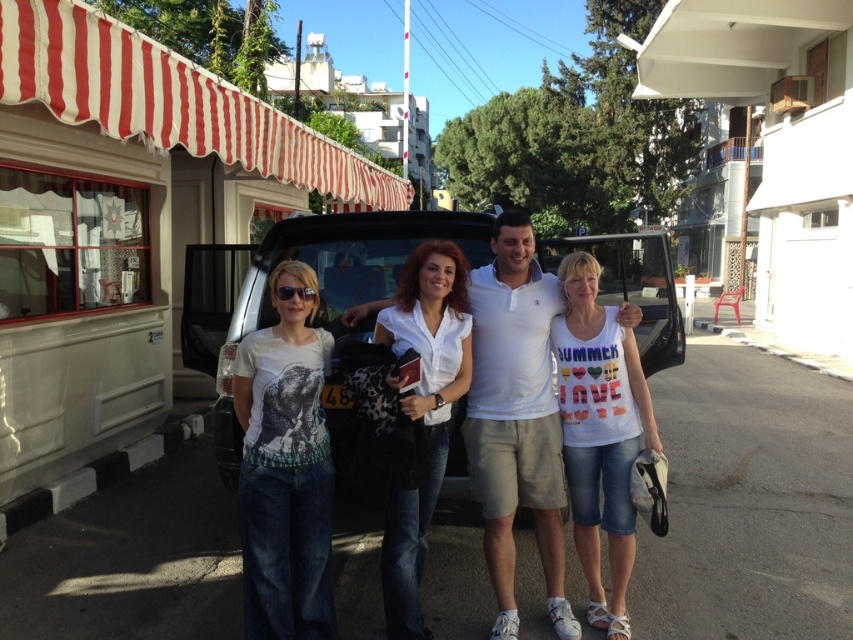
Does point (546, 484) lie behind point (305, 593)?

Yes, point (546, 484) is farther from viewer.

How much distance is there between white cotton polo shirt at center and white printed t-shirt at center?

A distance of 38.63 inches exists between white cotton polo shirt at center and white printed t-shirt at center.

What are the coordinates of `white cotton polo shirt at center` in the screenshot? It's located at (515, 417).

Is white cotton polo shirt at center wider than white cotton shirt at center?

Indeed, white cotton polo shirt at center has a greater width compared to white cotton shirt at center.

Does white cotton polo shirt at center have a larger size compared to white cotton shirt at center?

Yes, white cotton polo shirt at center is bigger than white cotton shirt at center.

Does point (503, 424) lie behind point (389, 346)?

Yes, point (503, 424) is behind point (389, 346).

The width and height of the screenshot is (853, 640). Find the location of `white cotton polo shirt at center`. white cotton polo shirt at center is located at coordinates (515, 417).

Does white cotton shirt at center appear on the right side of matte black sunglasses at center?

Indeed, white cotton shirt at center is positioned on the right side of matte black sunglasses at center.

Between white cotton shirt at center and matte black sunglasses at center, which one has less height?

matte black sunglasses at center

This screenshot has width=853, height=640. Describe the element at coordinates (422, 413) in the screenshot. I see `white cotton shirt at center` at that location.

Where is `white cotton shirt at center`? Image resolution: width=853 pixels, height=640 pixels. white cotton shirt at center is located at coordinates (422, 413).